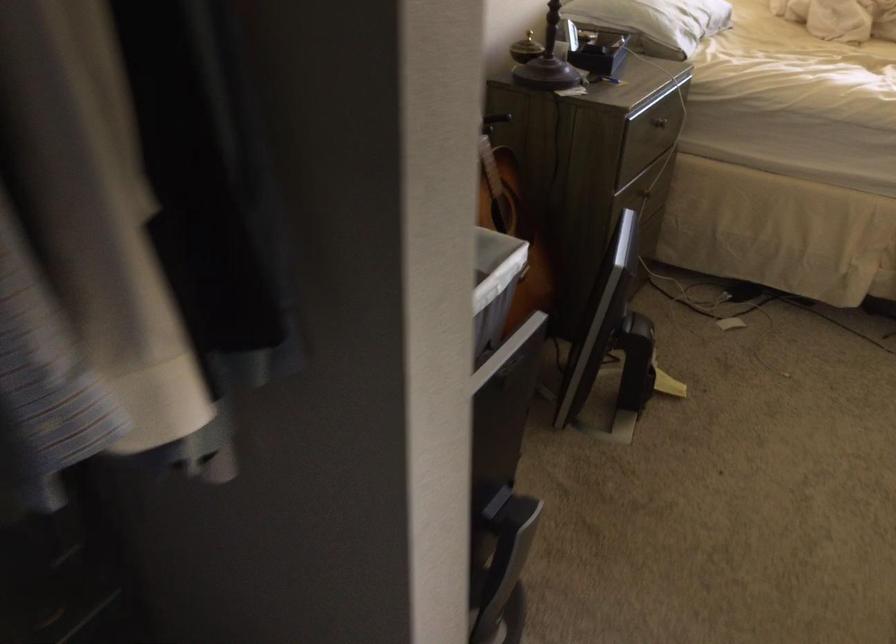
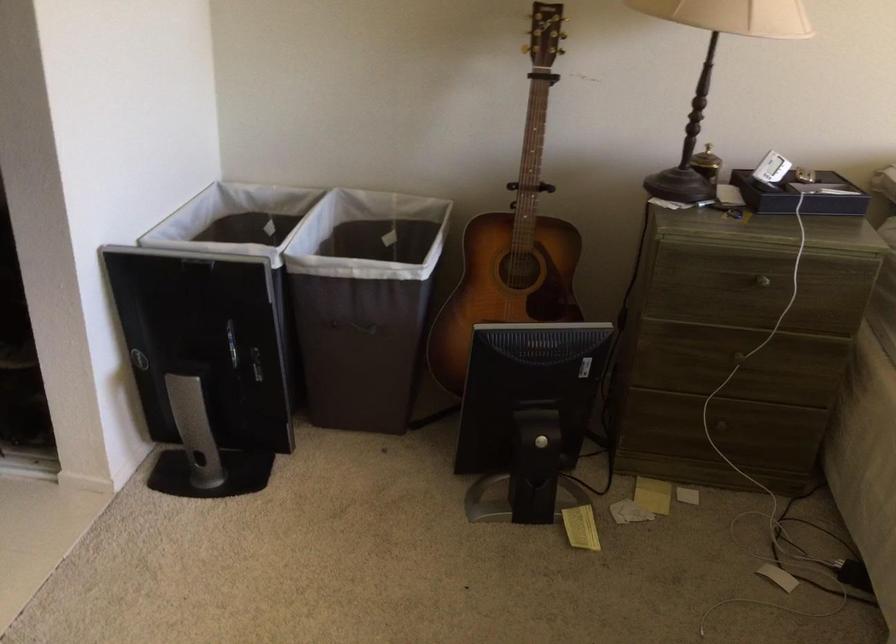
Where in the second image is the point corresponding to [650,194] from the first image?

(738, 357)